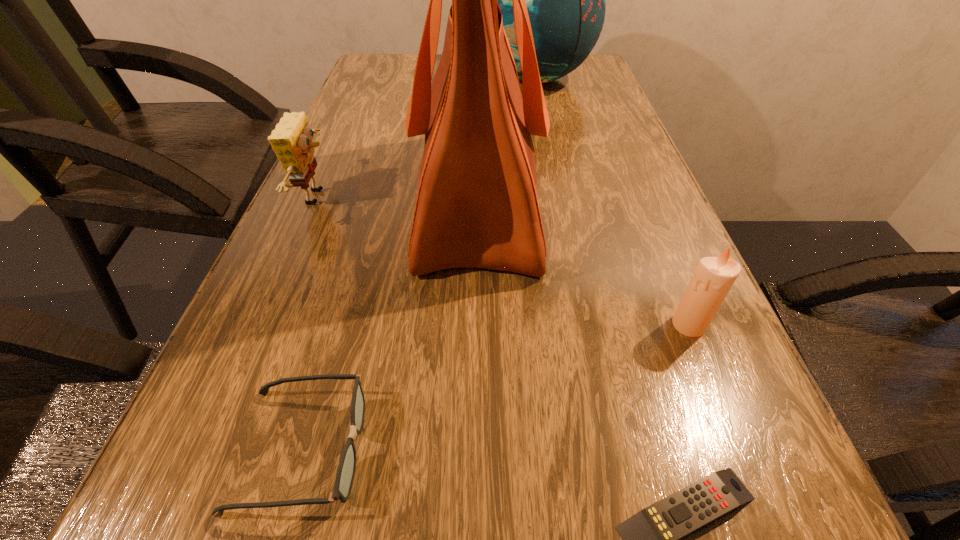
Locate an element on the screen. The width and height of the screenshot is (960, 540). free spot at the far left corner of the desktop is located at coordinates (391, 71).

Locate an element on the screen. vacant space in between the shopping bag and the second shortest object is located at coordinates (390, 323).

You are a GUI agent. You are given a task and a screenshot of the screen. Output one action in this format:
    pyautogui.click(x=<x>, y=<y>)
    Task: Click on the vacant region between the candle and the globe
    
    Given the screenshot: What is the action you would take?
    pyautogui.click(x=612, y=201)

I want to click on object identified as the fifth closest to the tallest object, so click(651, 538).

Locate an element on the screen. The image size is (960, 540). object that stands as the closest to the remote control is located at coordinates (713, 278).

What are the coordinates of `blank area in the image that satisfies the following two spatial constraints: 1. on the front side of the farthest object; 2. on the face of the sponge` in the screenshot? It's located at (560, 197).

The width and height of the screenshot is (960, 540). Identify the location of vacant position in the image that satisfies the following two spatial constraints: 1. on the front side of the farthest object; 2. on the face of the second shortest object. (613, 449).